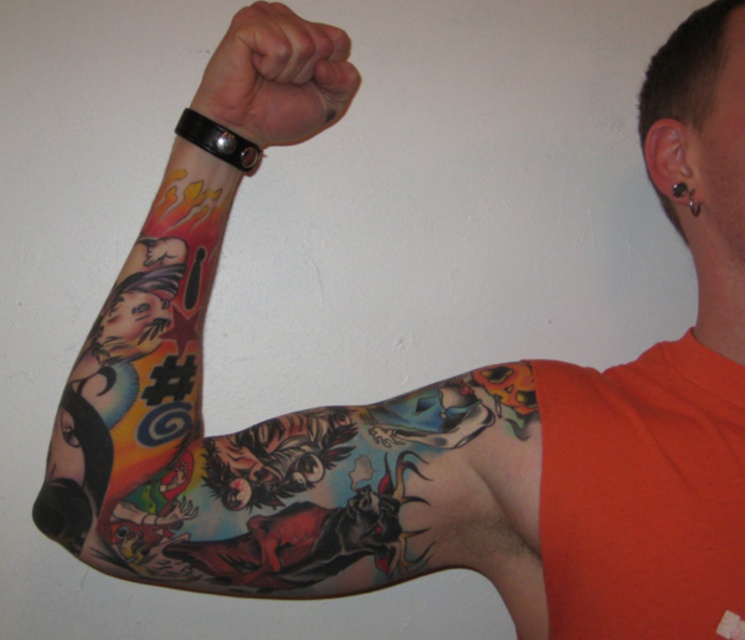
Is colorful tattooed arm at upper left shorter than black leather wristband at upper center?

Incorrect, colorful tattooed arm at upper left's height does not fall short of black leather wristband at upper center's.

Is colorful tattooed arm at upper left thinner than black leather wristband at upper center?

No.

Where is `colorful tattooed arm at upper left`? colorful tattooed arm at upper left is located at coordinates (187, 252).